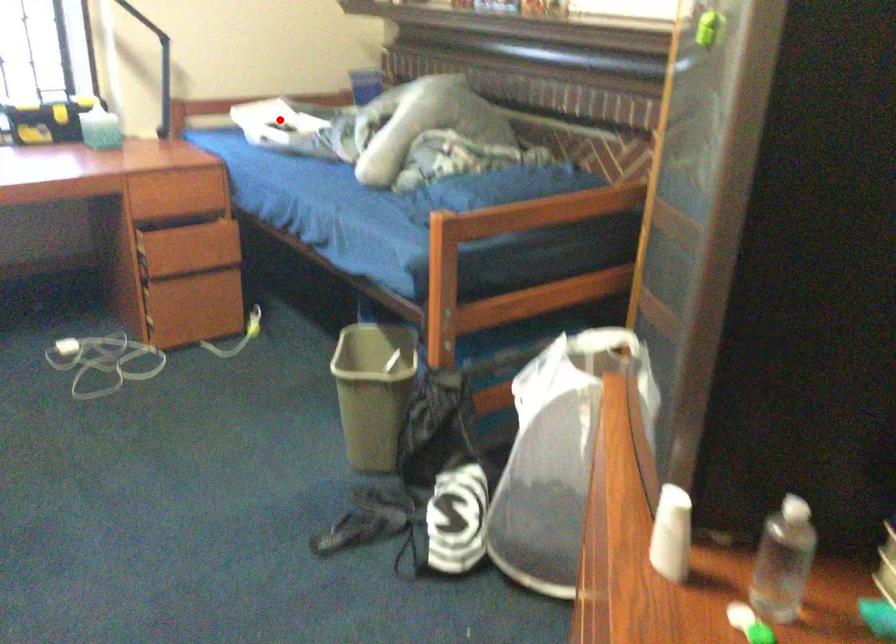
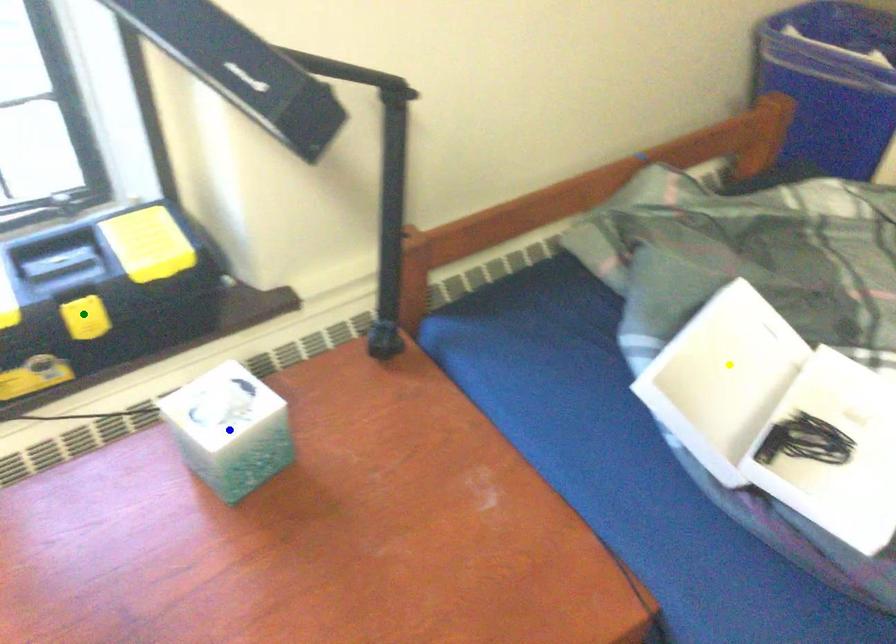
Question: I am providing you with two images of the same scene from different viewpoints. A red point is marked on the first image. You are given multiple points on the second image. Which point in image 2 represents the same 3d spot as the red point in image 1?

Choices:
 (A) green point
 (B) yellow point
 (C) blue point

Answer: (B)